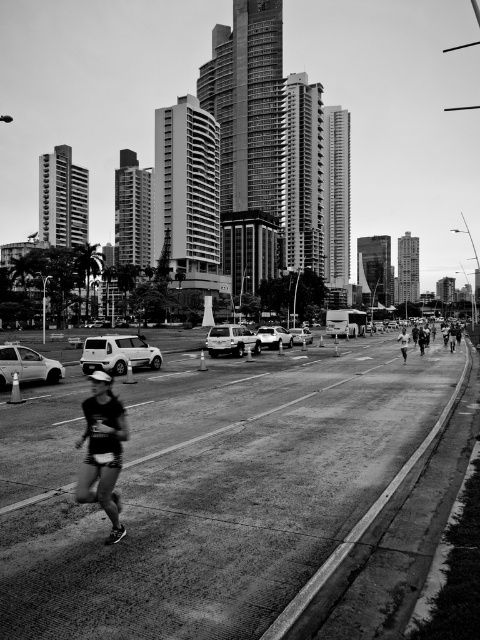
Is dark gray fabric shorts at lower left to the right of matte silver suv at center from the viewer's perspective?

In fact, dark gray fabric shorts at lower left is to the left of matte silver suv at center.

Between dark gray fabric shorts at lower left and matte silver suv at center, which one is positioned higher?

matte silver suv at center

You are a GUI agent. You are given a task and a screenshot of the screen. Output one action in this format:
    pyautogui.click(x=<x>, y=<y>)
    Task: Click on the dark gray fabric shorts at lower left
    
    Given the screenshot: What is the action you would take?
    pyautogui.click(x=103, y=451)

Does matte white suv at center appear on the left side of metallic silver van at center?

Yes, matte white suv at center is to the left of metallic silver van at center.

Is matte white suv at center wider than metallic silver van at center?

Indeed, matte white suv at center has a greater width compared to metallic silver van at center.

Who is more distant from viewer, (124, 337) or (279, 339)?

Positioned behind is point (279, 339).

Locate an element on the screen. Image resolution: width=480 pixels, height=640 pixels. matte white suv at center is located at coordinates (118, 353).

Who is positioned more to the left, metallic silver van at center or metallic silver sedan at center?

metallic silver van at center is more to the left.

Who is shorter, metallic silver van at center or metallic silver sedan at center?

metallic silver van at center is shorter.

Where is `metallic silver van at center`? This screenshot has height=640, width=480. metallic silver van at center is located at coordinates (274, 337).

The image size is (480, 640). Find the location of `metallic silver van at center`. metallic silver van at center is located at coordinates (274, 337).